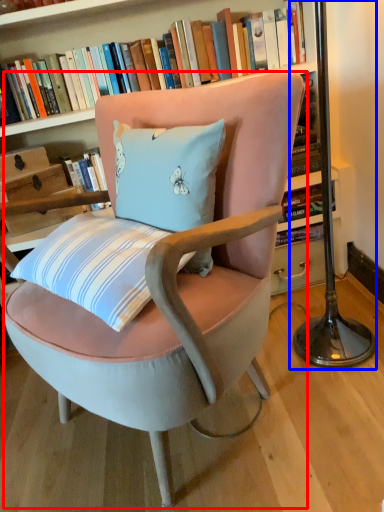
Question: Among these objects, which one is nearest to the camera, chair (highlighted by a red box) or table lamp (highlighted by a blue box)?

Choices:
 (A) chair
 (B) table lamp

Answer: (A)